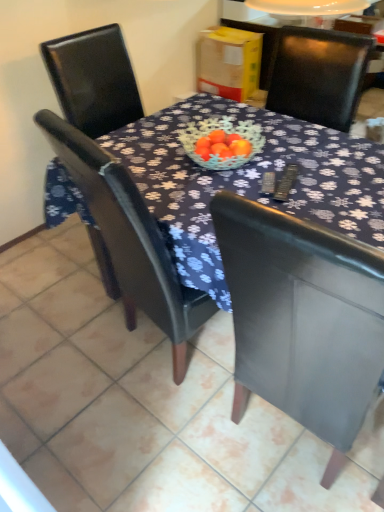
Question: Is matte black chair at center, marked as the 1th chair in a left-to-right arrangement, facing away from matte black chair at center, the 2th chair positioned from the left?

Choices:
 (A) no
 (B) yes

Answer: (A)

Question: Does matte black chair at center, marked as the 1th chair in a left-to-right arrangement, lie in front of matte black chair at center, the first chair from the right?

Choices:
 (A) no
 (B) yes

Answer: (A)

Question: From a real-world perspective, is matte black chair at center, arranged as the 2th chair when viewed from the right, on top of matte black chair at center, the first chair from the right?

Choices:
 (A) yes
 (B) no

Answer: (A)

Question: Can you confirm if matte black chair at center, marked as the 1th chair in a left-to-right arrangement, is wider than matte black chair at center, the first chair from the right?

Choices:
 (A) no
 (B) yes

Answer: (B)

Question: Is matte black chair at center, arranged as the 2th chair when viewed from the right, at the right side of matte black chair at center, the first chair from the right?

Choices:
 (A) yes
 (B) no

Answer: (B)

Question: From the image's perspective, is matte black chair at center, marked as the 1th chair in a left-to-right arrangement, located above matte black chair at center, the first chair from the right?

Choices:
 (A) yes
 (B) no

Answer: (A)

Question: Is matte black chair at center, the 2th chair positioned from the left, to the right of matte black chair at center, arranged as the 2th chair when viewed from the right, from the viewer's perspective?

Choices:
 (A) no
 (B) yes

Answer: (B)

Question: From the image's perspective, is matte black chair at center, the 2th chair positioned from the left, beneath matte black chair at center, marked as the 1th chair in a left-to-right arrangement?

Choices:
 (A) no
 (B) yes

Answer: (B)

Question: Can you confirm if matte black chair at center, the first chair from the right, is positioned to the left of matte black chair at center, marked as the 1th chair in a left-to-right arrangement?

Choices:
 (A) no
 (B) yes

Answer: (A)

Question: Is the depth of matte black chair at center, the 2th chair positioned from the left, greater than that of matte black chair at center, arranged as the 2th chair when viewed from the right?

Choices:
 (A) yes
 (B) no

Answer: (B)

Question: From a real-world perspective, is matte black chair at center, the 2th chair positioned from the left, located beneath matte black chair at center, arranged as the 2th chair when viewed from the right?

Choices:
 (A) no
 (B) yes

Answer: (B)

Question: From the image's perspective, is matte black chair at center, the first chair from the right, on top of matte black chair at center, arranged as the 2th chair when viewed from the right?

Choices:
 (A) no
 (B) yes

Answer: (A)

Question: From a real-world perspective, is matte black chair at center, the 2th chair positioned from the left, positioned above or below matte black chair at center, marked as the 1th chair in a left-to-right arrangement?

Choices:
 (A) below
 (B) above

Answer: (A)